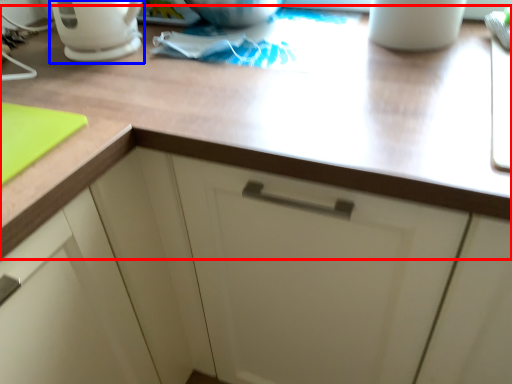
Question: Which point is further to the camera, countertop (highlighted by a red box) or coffeepot (highlighted by a blue box)?

Choices:
 (A) countertop
 (B) coffeepot

Answer: (B)